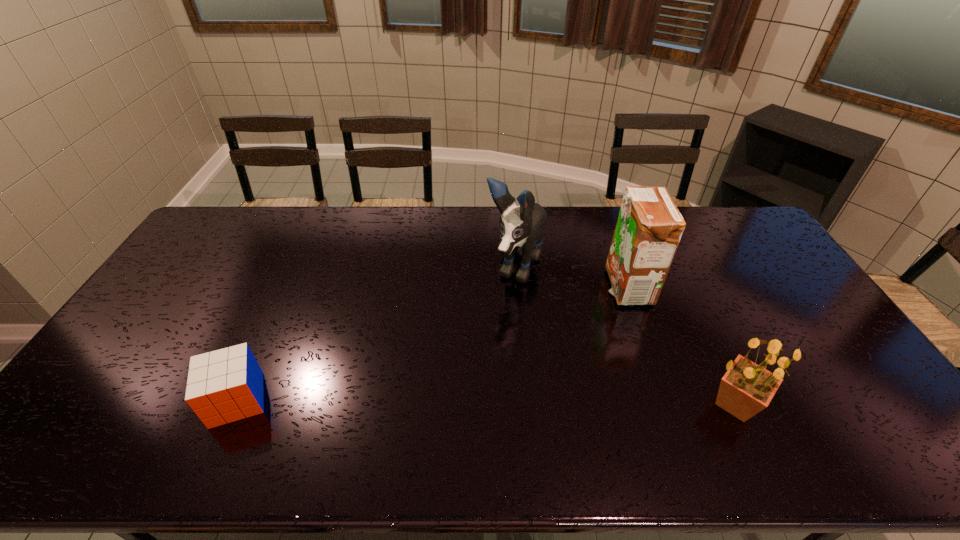
Locate an element on the screen. vacant region that satisfies the following two spatial constraints: 1. on the front side of the third tallest object; 2. at the front of the shortest object with flowers visible is located at coordinates (235, 404).

The image size is (960, 540). In order to click on vacant space that satisfies the following two spatial constraints: 1. on the front side of the rightmost object; 2. at the front of the third object from right to left with flowers visible in this screenshot , I will do `click(527, 404)`.